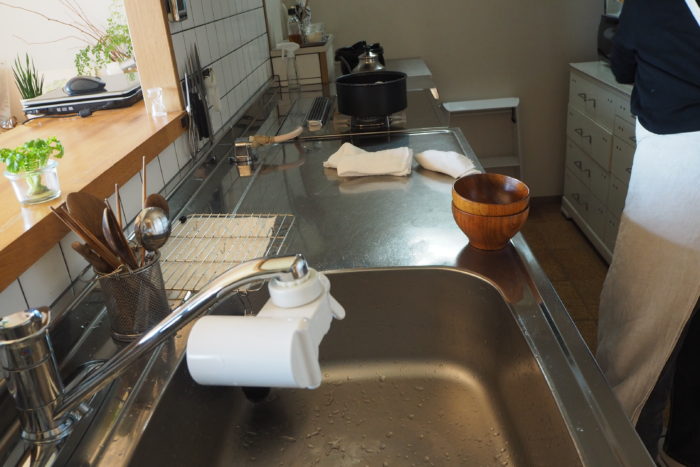
Where is `floor`? floor is located at coordinates (554, 256).